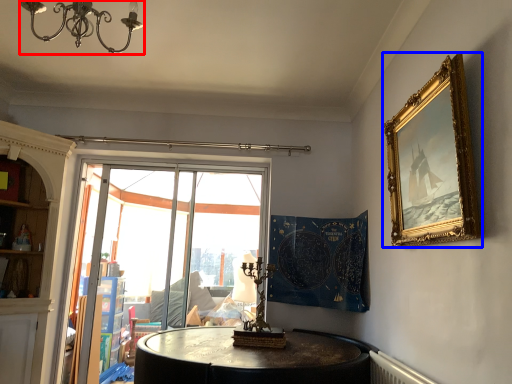
Question: Which point is further to the camera, light fixture (highlighted by a red box) or picture frame (highlighted by a blue box)?

Choices:
 (A) light fixture
 (B) picture frame

Answer: (B)